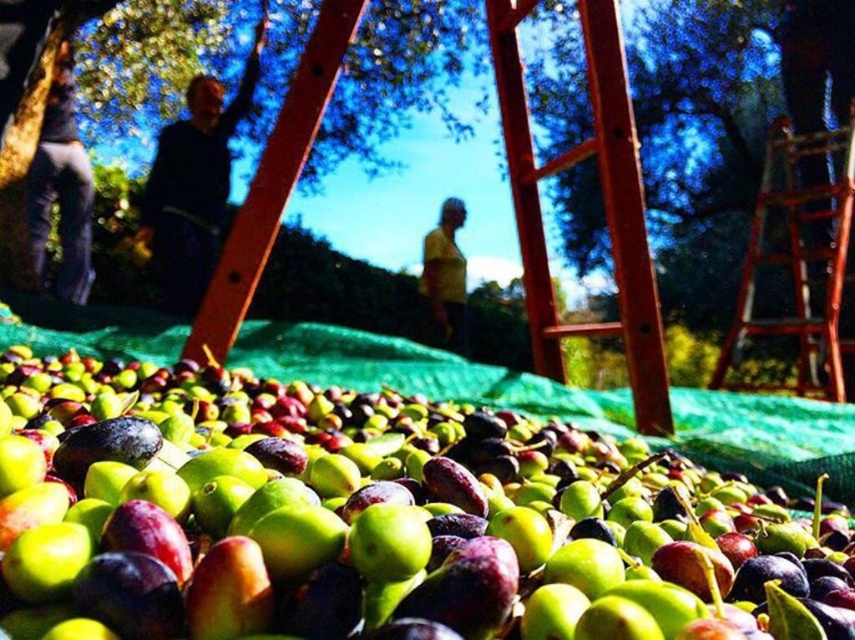
Does green matte olives at center have a smaller size compared to metallic red ladder at right?

Yes, green matte olives at center is smaller than metallic red ladder at right.

Looking at this image, between green matte olives at center and metallic red ladder at right, which one has less height?

Standing shorter between the two is green matte olives at center.

This screenshot has width=855, height=640. What do you see at coordinates (376, 522) in the screenshot?
I see `green matte olives at center` at bounding box center [376, 522].

This screenshot has height=640, width=855. What are the coordinates of `green matte olives at center` in the screenshot? It's located at (376, 522).

Which is more to the right, metallic red ladder at right or dark blue sweater at upper left?

From the viewer's perspective, metallic red ladder at right appears more on the right side.

Does metallic red ladder at right appear over dark blue sweater at upper left?

No, metallic red ladder at right is not above dark blue sweater at upper left.

Image resolution: width=855 pixels, height=640 pixels. Identify the location of metallic red ladder at right. (799, 260).

Find the location of a particular element. metallic red ladder at right is located at coordinates [799, 260].

Is point (75, 168) behind point (447, 284)?

No, (75, 168) is closer to viewer.

Who is taller, dark blue jeans at left or yellow matte shirt at center?

dark blue jeans at left

Where is `dark blue jeans at left`? The width and height of the screenshot is (855, 640). dark blue jeans at left is located at coordinates (62, 188).

At what (x,y) coordinates should I click in order to perform the action: click on dark blue jeans at left. Please return your answer as a coordinate pair (x, y). Looking at the image, I should click on (62, 188).